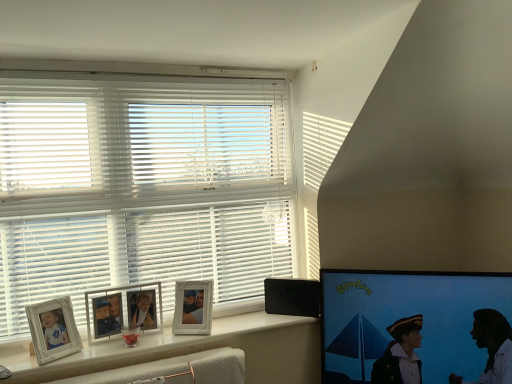
You are a GUI agent. You are given a task and a screenshot of the screen. Output one action in this format:
    pyautogui.click(x=<x>, y=<y>)
    Task: Click on the spots to the right of white wooden picture frame at lower left, acting as the second picture frame starting from the right
    
    Given the screenshot: What is the action you would take?
    pyautogui.click(x=158, y=339)